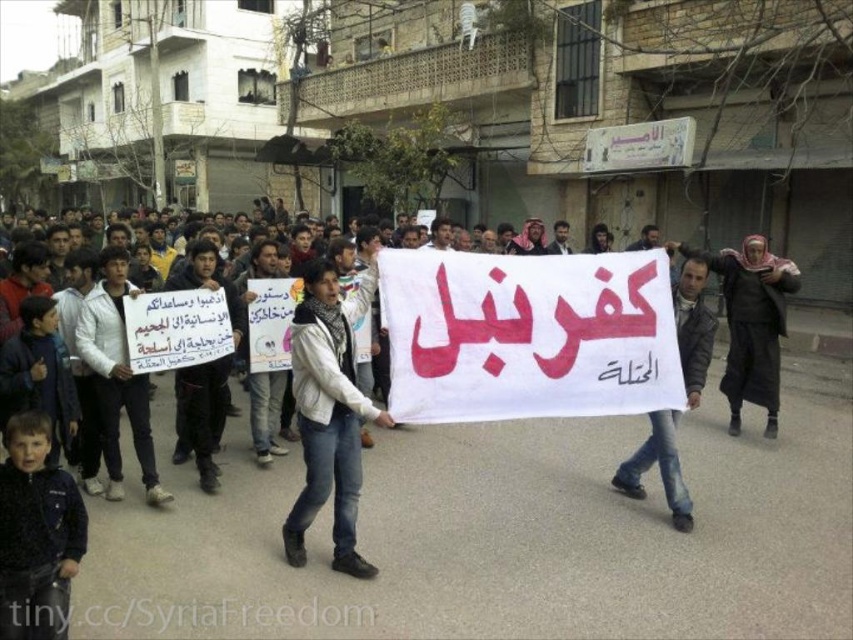
Looking at this image, you are a photographer standing at the front of the protest scene. You want to take a photo focusing on the white matte jacket at center and the dark gray jacket at center. Which jacket will appear larger in your photo?

The white matte jacket at center will appear larger in the photo because it is closer to the viewer than the dark gray jacket at center.

You are a photographer trying to capture a clear shot of both the white matte jacket at center and the dark gray jacket at center in the protest scene. Since you want to ensure both jackets are fully visible in the frame, which jacket requires a wider angle to accommodate its size?

The white matte jacket at center requires a wider angle because its width is larger than the dark gray jacket at center.